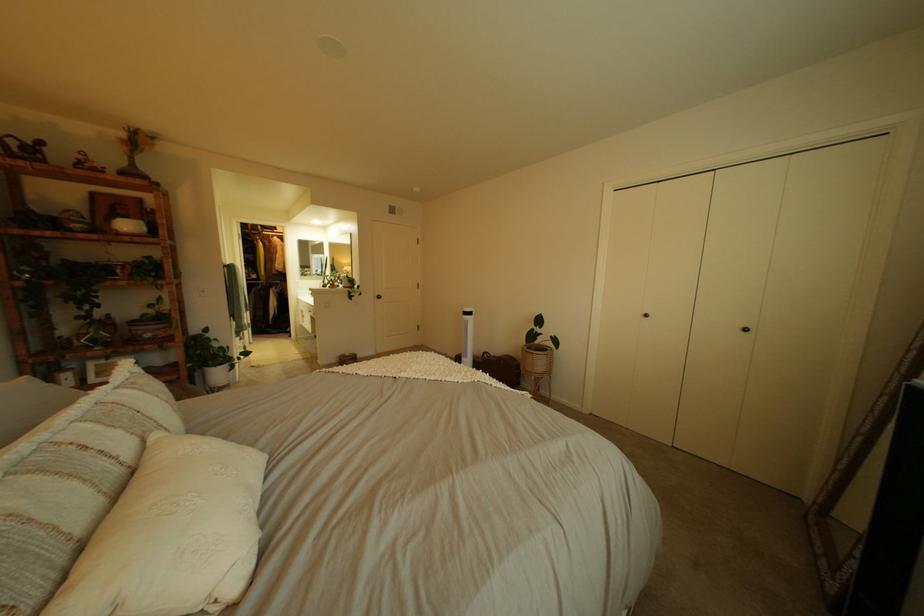
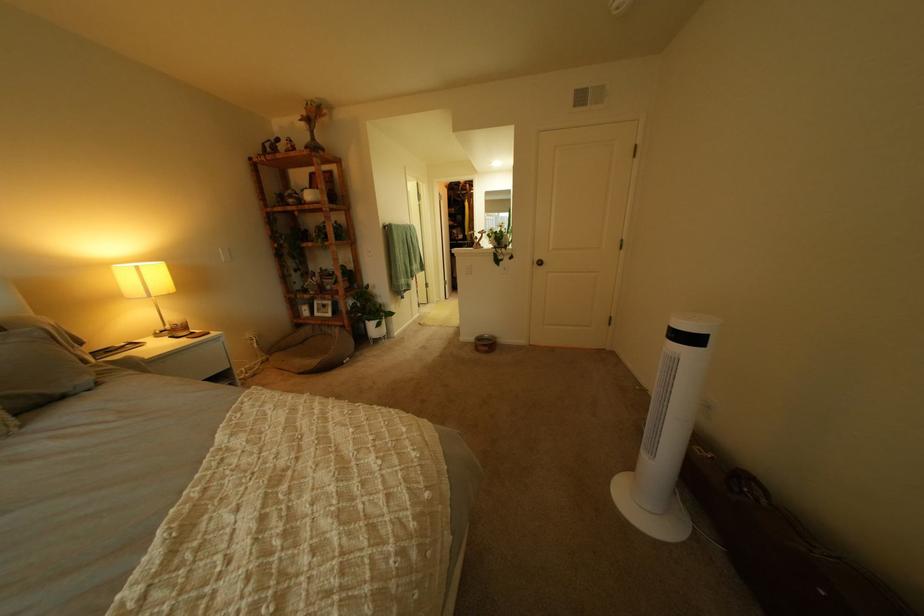
Locate, in the second image, the point that corresponds to point (485, 315) in the first image.

(710, 341)